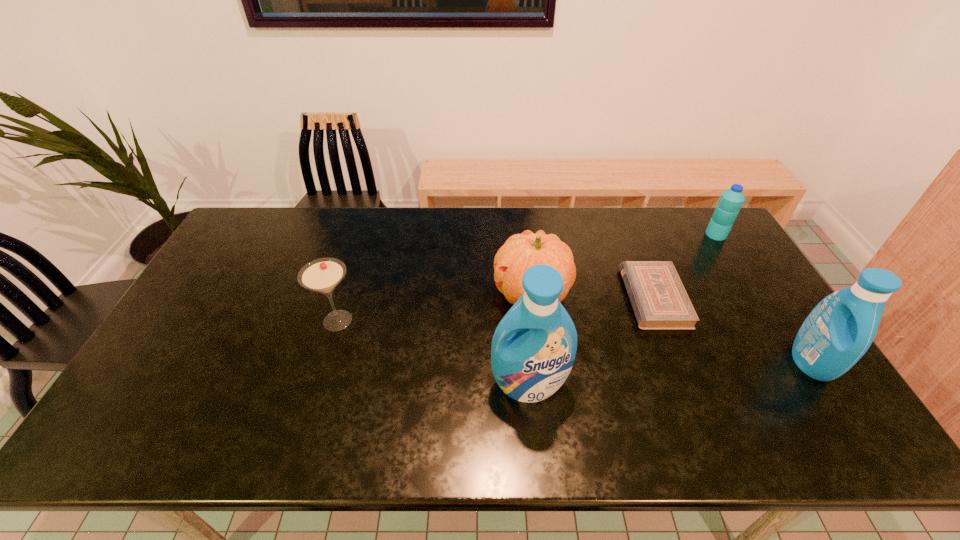
At what (x,y) coordinates should I click in order to perform the action: click on free point that keeps the detergents evenly spaced on the left. Please return your answer as a coordinate pair (x, y). The width and height of the screenshot is (960, 540). Looking at the image, I should click on (222, 409).